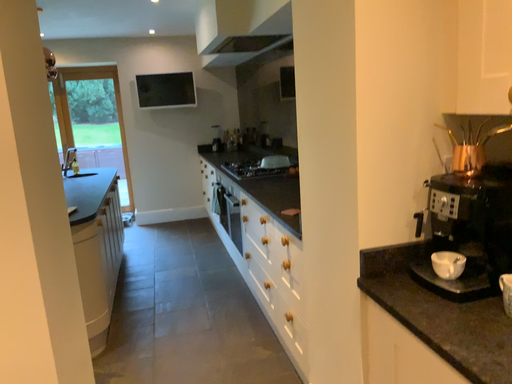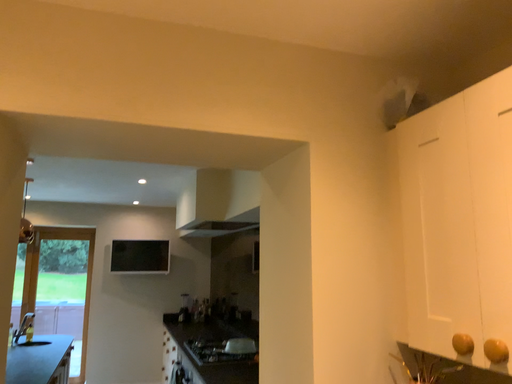
Question: Which way did the camera rotate in the video?

Choices:
 (A) rotated upward
 (B) rotated downward

Answer: (A)